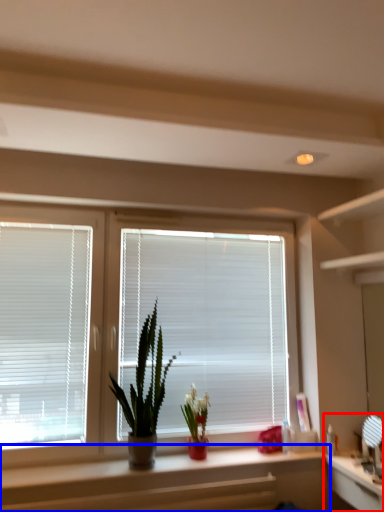
Question: Among these objects, which one is farthest to the camera, computer (highlighted by a red box) or counter (highlighted by a blue box)?

Choices:
 (A) computer
 (B) counter

Answer: (B)